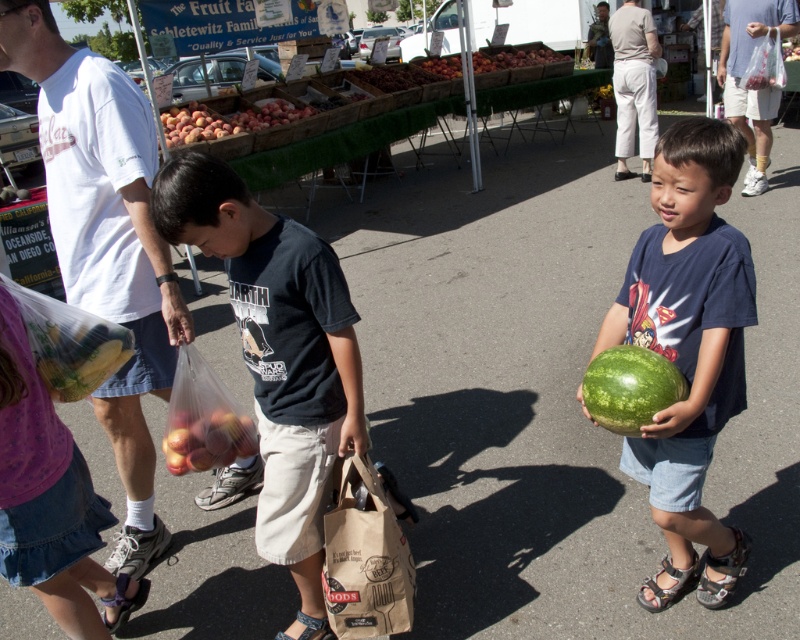
You are a photographer trying to capture the brown paper bag at lower center without the green matte watermelon at right blocking it. Which direction should you move to ensure the watermelon is out of the frame?

The green matte watermelon at right is in front of the brown paper bag at lower center. To avoid blocking the bag, move to the left side so the watermelon moves out of the frame.

You are a parent at the market and want to buy both the green textured watermelon at center and the green textured sandal at lower right. However, your shopping bag can only hold items that are smaller than the watermelon. Which item should you place in the bag first to ensure it fits?

The green textured sandal at lower right is smaller than the green textured watermelon at center, so you should place the green textured sandal at lower right in the bag first to ensure it fits before adding the larger watermelon.

You are a parent at the market and want to buy both the green matte watermelon at right and the shiny red apples at lower left. Which item is taller?

The green matte watermelon at right is much taller than the shiny red apples at lower left.